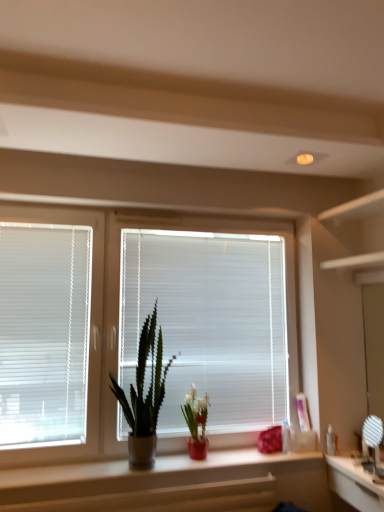
The image size is (384, 512). Find the location of `free spot above white glossy mirror at lower right (from a real-world perspective)`. free spot above white glossy mirror at lower right (from a real-world perspective) is located at coordinates (366, 468).